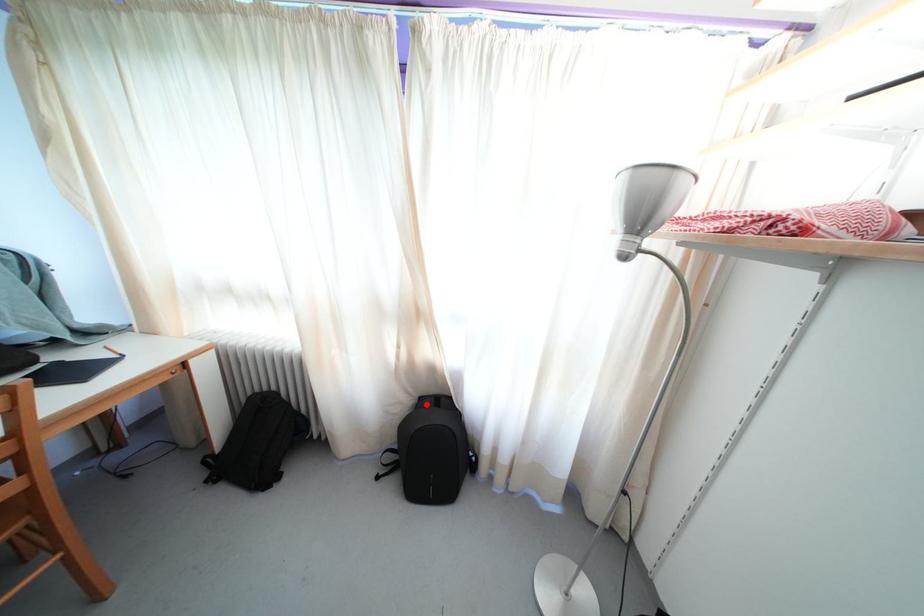
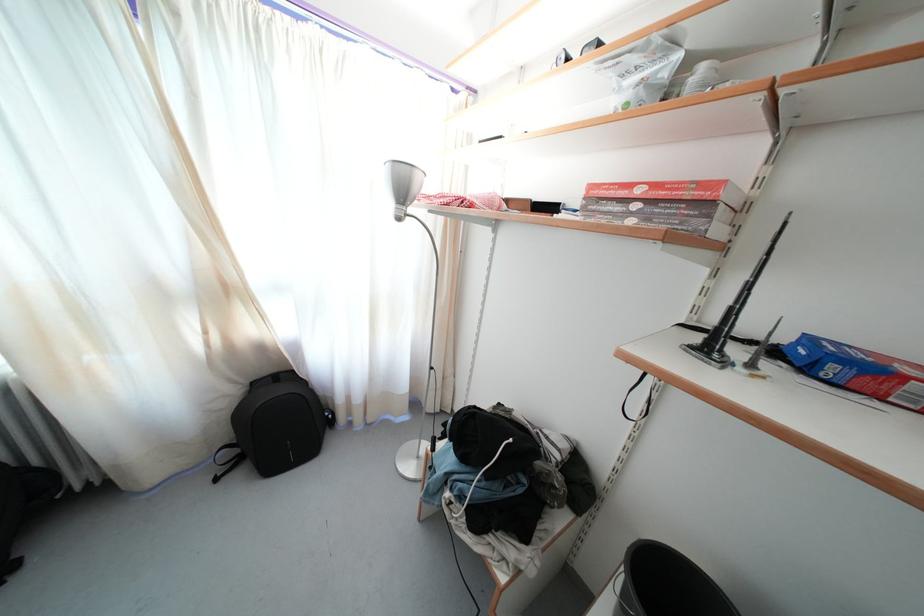
Where in the second image is the point corresponding to the highlighted location from the first image?

(259, 390)